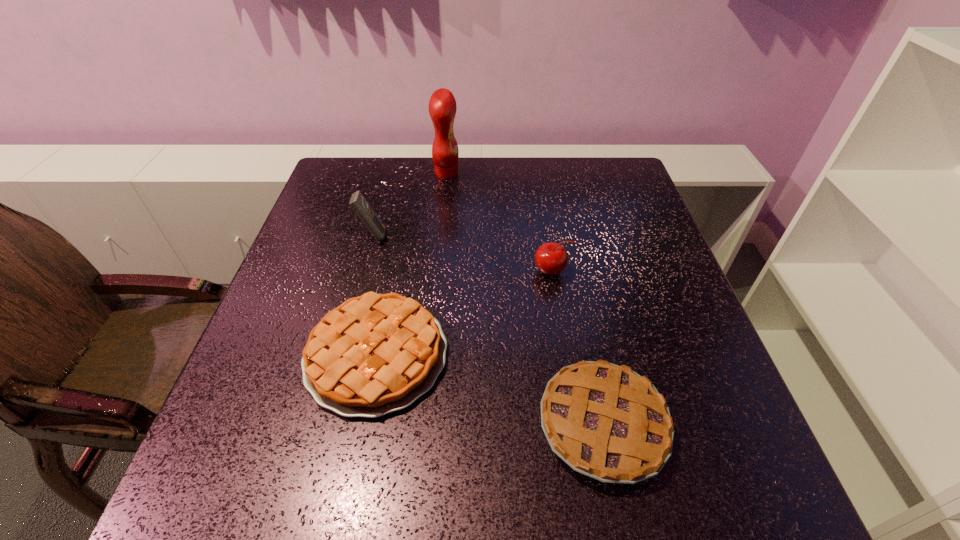
This screenshot has height=540, width=960. In order to click on vacant space at the left edge in this screenshot , I will do `click(299, 308)`.

Identify the location of free space at the right edge of the desktop. (647, 297).

Where is `free spot at the far left corner of the desktop`? free spot at the far left corner of the desktop is located at coordinates (358, 183).

Image resolution: width=960 pixels, height=540 pixels. In the image, there is a desktop. Identify the location of vacant space at the far right corner. (640, 193).

The width and height of the screenshot is (960, 540). What are the coordinates of `free space at the near right corner of the desktop` in the screenshot? It's located at (734, 469).

The image size is (960, 540). I want to click on blank region between the calculator and the cherry, so click(463, 254).

Locate an element on the screen. unoccupied position between the left pie and the third farthest object is located at coordinates (465, 313).

Where is `vacant area between the fourth nearest object and the tallest object`? vacant area between the fourth nearest object and the tallest object is located at coordinates pyautogui.click(x=410, y=205).

The width and height of the screenshot is (960, 540). I want to click on free spot between the farthest object and the left pie, so click(x=412, y=264).

The height and width of the screenshot is (540, 960). In order to click on vacant space in between the third nearest object and the calculator in this screenshot , I will do `click(463, 254)`.